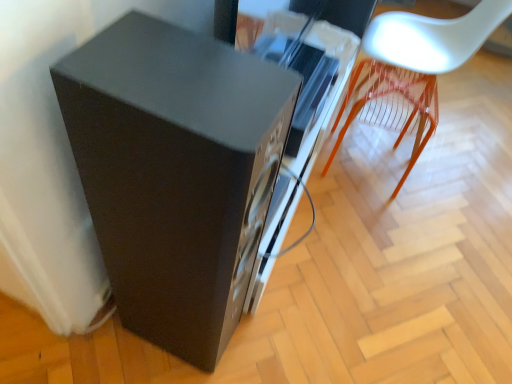
At what (x,y) coordinates should I click in order to perform the action: click on empty space that is ontop of matte black speaker at lower left (from a real-world perspective). Please return your answer as a coordinate pair (x, y). This screenshot has height=384, width=512. Looking at the image, I should click on (165, 76).